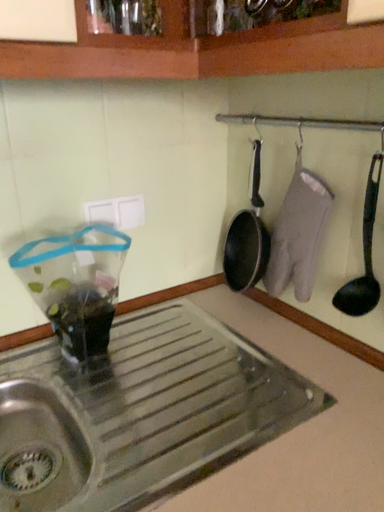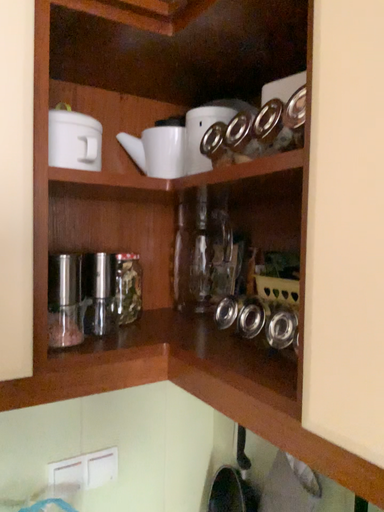
Question: Which way did the camera rotate in the video?

Choices:
 (A) rotated upward
 (B) rotated downward

Answer: (A)